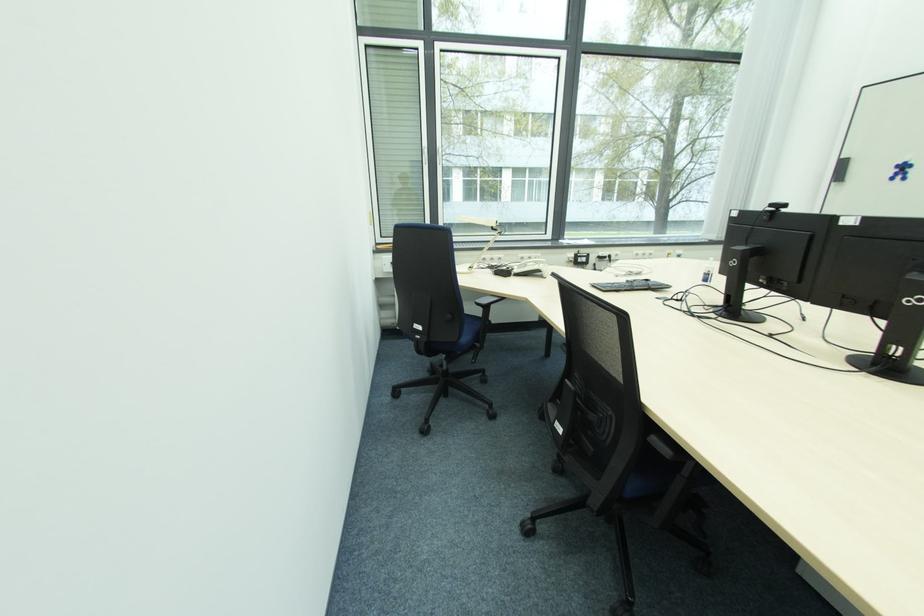
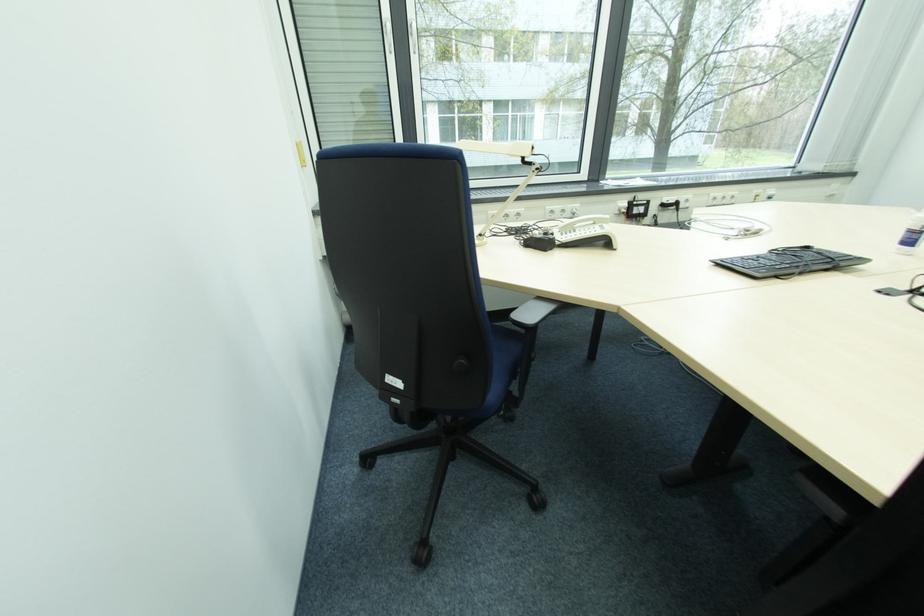
Question: What movement of the cameraman would produce the second image?

Choices:
 (A) Left
 (B) Right
 (C) Forward
 (D) Backward

Answer: (C)